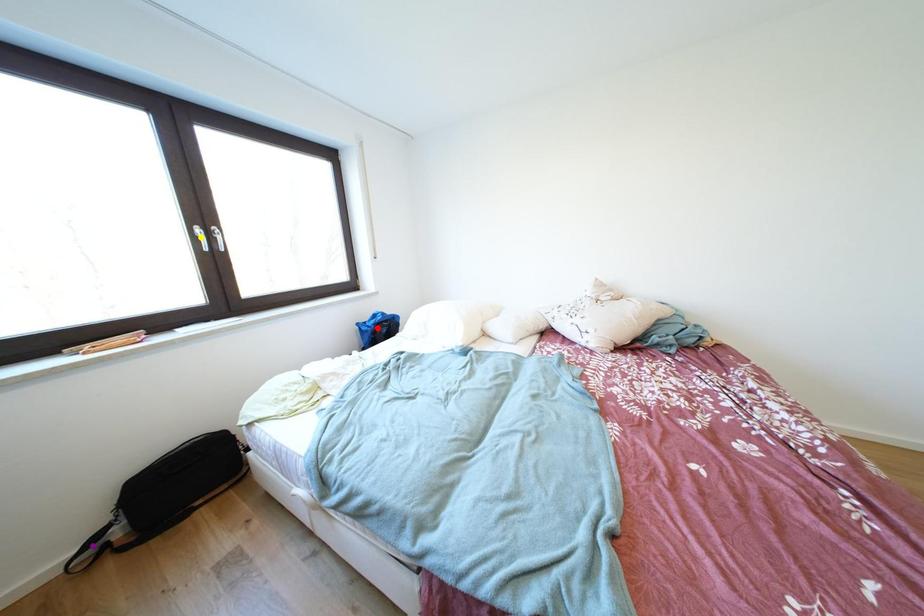
Order these from nearest to farthest:
purple point
yellow point
red point

red point < yellow point < purple point